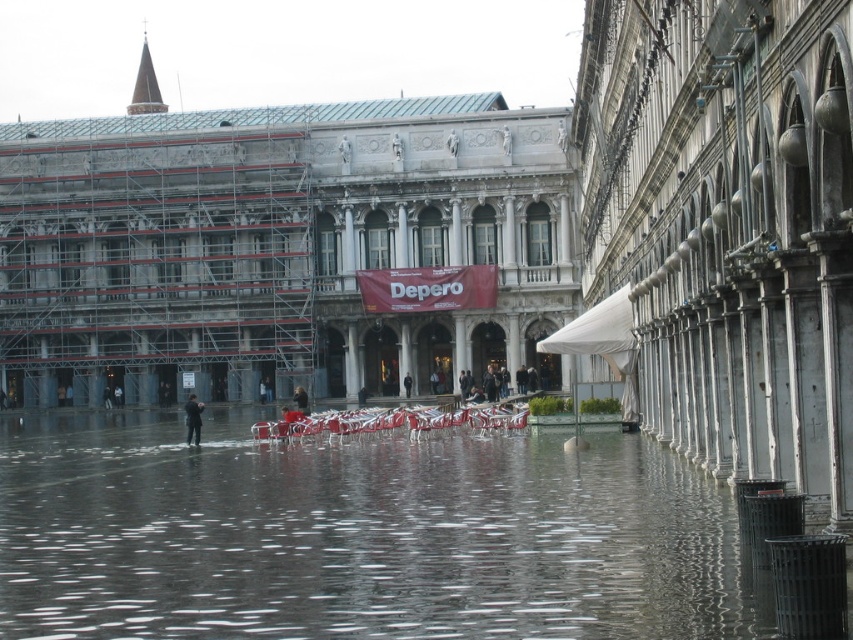
Is stone marble palace at center wider than dark suit at center?

Correct, the width of stone marble palace at center exceeds that of dark suit at center.

How distant is stone marble palace at center from dark suit at center?

stone marble palace at center and dark suit at center are 72.13 feet apart.

Where is `stone marble palace at center`? The image size is (853, 640). stone marble palace at center is located at coordinates (279, 248).

Which is behind, point (810, 74) or point (303, 403)?

The point (303, 403) is behind.

Which is more to the left, rusty metal columns at right or black leather jacket at center?

black leather jacket at center

Does point (759, 296) come closer to viewer compared to point (297, 404)?

Yes, it is in front of point (297, 404).

Locate an element on the screen. The image size is (853, 640). rusty metal columns at right is located at coordinates (728, 227).

Is point (270, 465) closer to viewer compared to point (196, 433)?

That is True.

Between clear water at center and dark suit at center, which one has less height?

With less height is clear water at center.

What are the coordinates of `clear water at center` in the screenshot? It's located at (358, 536).

Where is `clear water at center`? The height and width of the screenshot is (640, 853). clear water at center is located at coordinates (x=358, y=536).